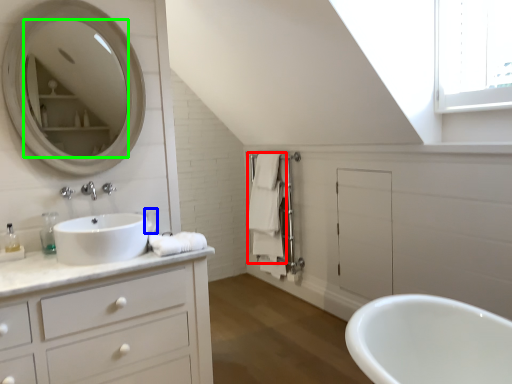
Question: Based on their relative distances, which object is nearer to bath towel (highlighted by a red box)? Choose from toiletry (highlighted by a blue box) and mirror (highlighted by a green box).

Choices:
 (A) toiletry
 (B) mirror

Answer: (A)